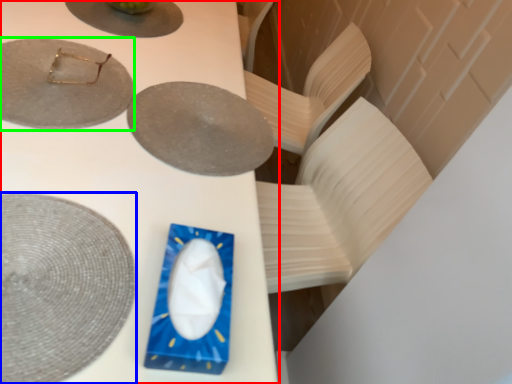
Question: Estimate the real-world distances between objects in this image. Which object is closer to table (highlighted by a red box), plate (highlighted by a blue box) or plate (highlighted by a green box)?

Choices:
 (A) plate
 (B) plate

Answer: (B)